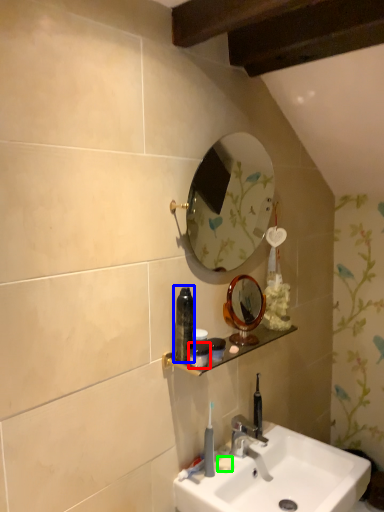
Question: Estimate the real-world distances between objects in this image. Which object is farther from mouthwash (highlighted by a red box), mouthwash (highlighted by a blue box) or soap (highlighted by a green box)?

Choices:
 (A) mouthwash
 (B) soap

Answer: (B)